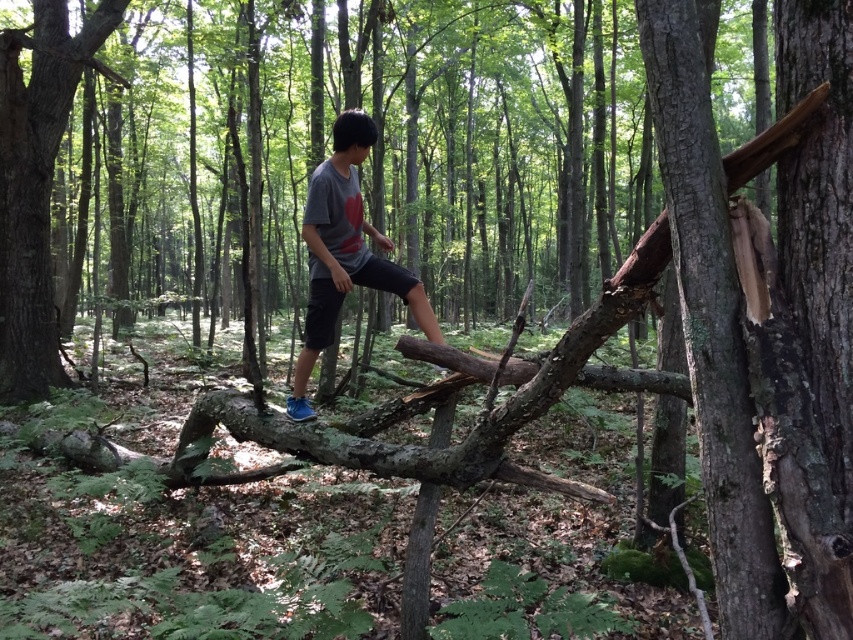
Question: Which is nearer to the smooth brown tree trunk at left?

Choices:
 (A) gray cotton t-shirt at center
 (B) smooth brown tree trunk at center right

Answer: (A)

Question: Where is smooth brown tree trunk at center right located in relation to gray cotton t-shirt at center in the image?

Choices:
 (A) below
 (B) above

Answer: (A)

Question: Can you confirm if smooth brown tree trunk at center right is positioned to the right of gray cotton t-shirt at center?

Choices:
 (A) no
 (B) yes

Answer: (B)

Question: Which point is farther to the camera?

Choices:
 (A) (641, 36)
 (B) (105, 17)

Answer: (B)

Question: Which object is positioned closest to the smooth brown tree trunk at center right?

Choices:
 (A) smooth brown tree trunk at left
 (B) gray cotton t-shirt at center

Answer: (B)

Question: Is smooth brown tree trunk at center right bigger than smooth brown tree trunk at left?

Choices:
 (A) no
 (B) yes

Answer: (A)